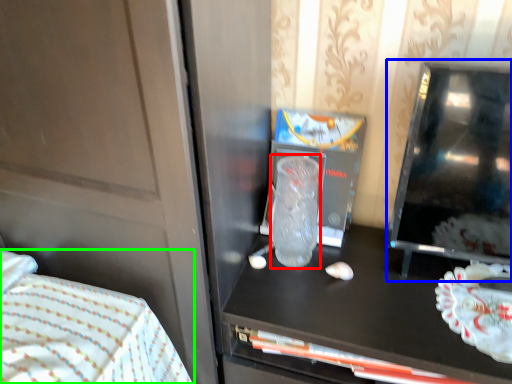
Question: Considering the real-world distances, which object is farthest from glass vase (highlighted by a red box)? appliance (highlighted by a blue box) or bed (highlighted by a green box)?

Choices:
 (A) appliance
 (B) bed

Answer: (B)